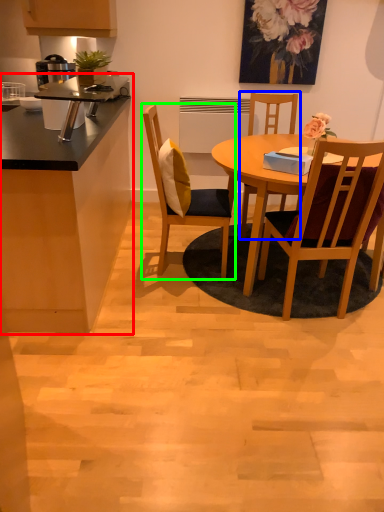
Question: Considering the real-world distances, which object is farthest from cabinetry (highlighted by a red box)? chair (highlighted by a blue box) or chair (highlighted by a green box)?

Choices:
 (A) chair
 (B) chair

Answer: (A)